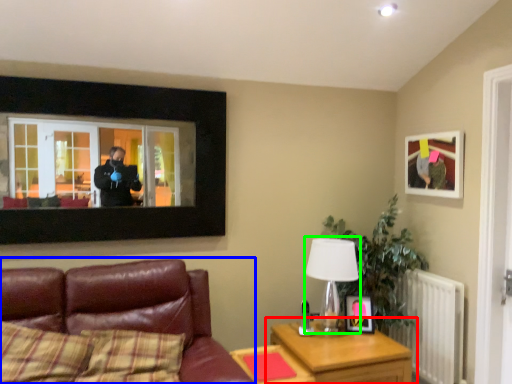
Question: Which object is positioned farthest from table (highlighted by a red box)? Select from studio couch (highlighted by a blue box) and table lamp (highlighted by a green box).

Choices:
 (A) studio couch
 (B) table lamp

Answer: (A)